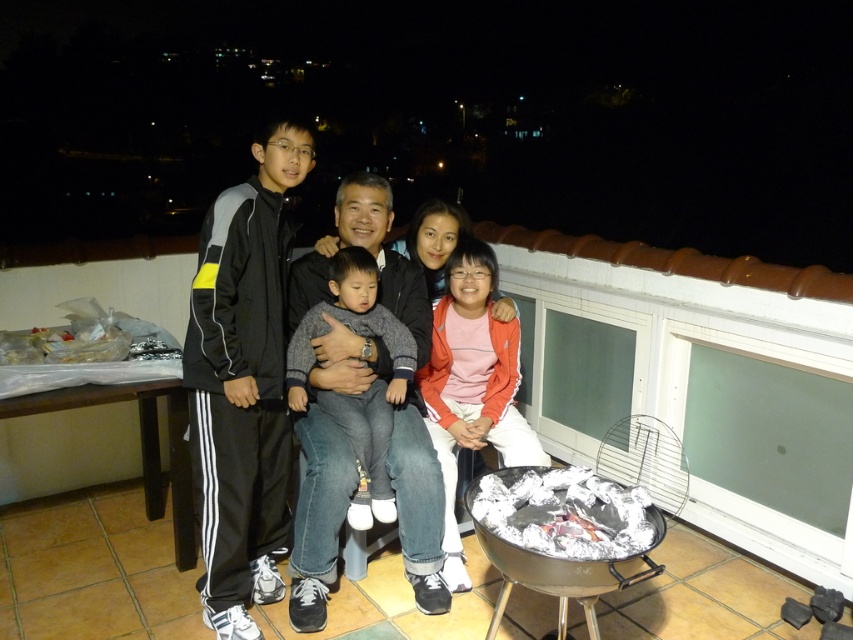
You are standing at point (314, 579) and want to walk to the barbecue grill. Is the point (339, 188) located behind you or in front of you?

Point (339, 188) is behind point (314, 579), so it is behind you.

You are a photographer trying to capture a candid shot of the family. You notice the black athletic suit at left and the dark blue jeans at center. Which clothing item should you focus on to ensure the subject wearing it is in the foreground of your photo?

The black athletic suit at left is located above the dark blue jeans at center, so focusing on the black athletic suit at left will ensure the subject wearing it is in the foreground.